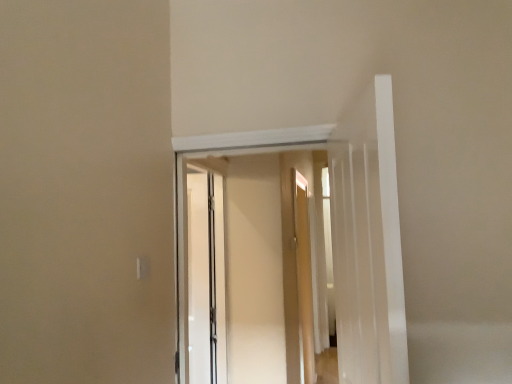
Question: Based on their positions, is white glossy door at upper center located to the left or right of clear glass screen door at center?

Choices:
 (A) right
 (B) left

Answer: (A)

Question: Looking at the image, does white glossy door at upper center seem bigger or smaller compared to clear glass screen door at center?

Choices:
 (A) big
 (B) small

Answer: (B)

Question: Is point (368, 289) closer or farther from the camera than point (192, 226)?

Choices:
 (A) farther
 (B) closer

Answer: (B)

Question: Does point (198, 326) appear closer or farther from the camera than point (358, 220)?

Choices:
 (A) closer
 (B) farther

Answer: (B)

Question: From a real-world perspective, is clear glass screen door at center positioned above or below white glossy door at upper center?

Choices:
 (A) above
 (B) below

Answer: (B)

Question: From their relative heights in the image, would you say clear glass screen door at center is taller or shorter than white glossy door at upper center?

Choices:
 (A) short
 (B) tall

Answer: (B)

Question: Considering the positions of clear glass screen door at center and white glossy door at upper center in the image, is clear glass screen door at center wider or thinner than white glossy door at upper center?

Choices:
 (A) thin
 (B) wide

Answer: (A)